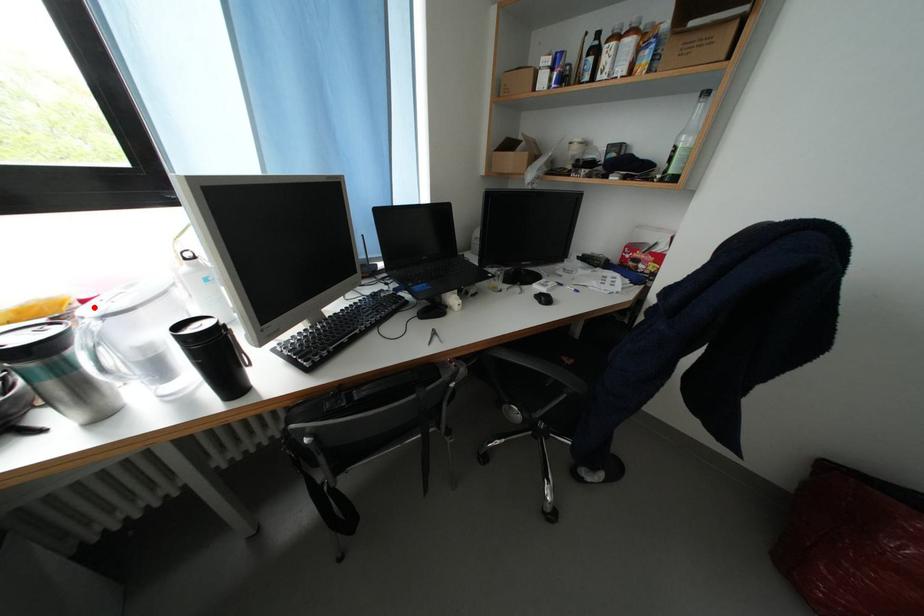
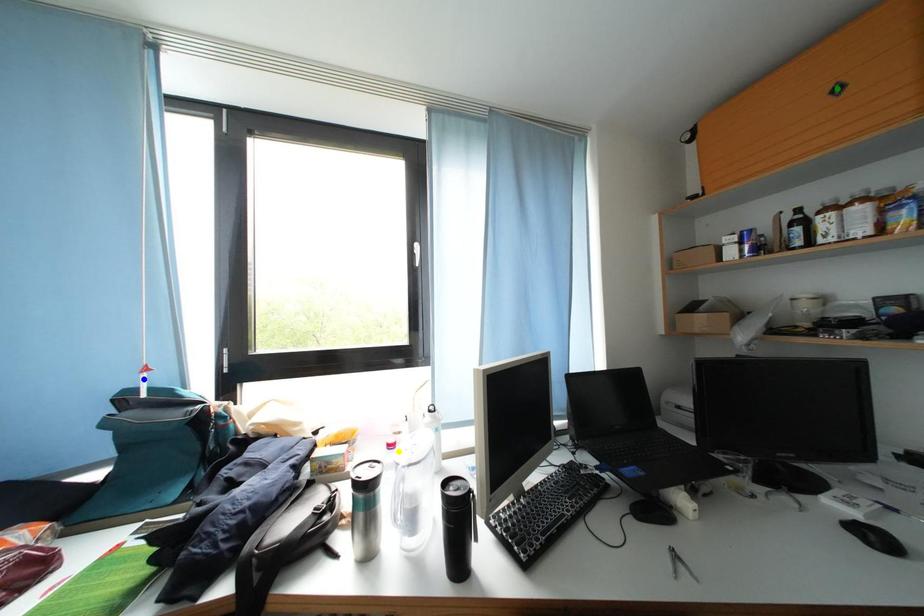
Question: I am providing you with two images of the same scene from different viewpoints. A red point is marked on the first image. You are given multiple points on the second image. Which point in image 2 represents the same 3d spot as the red point in image 1?

Choices:
 (A) blue point
 (B) yellow point
 (C) green point

Answer: (B)